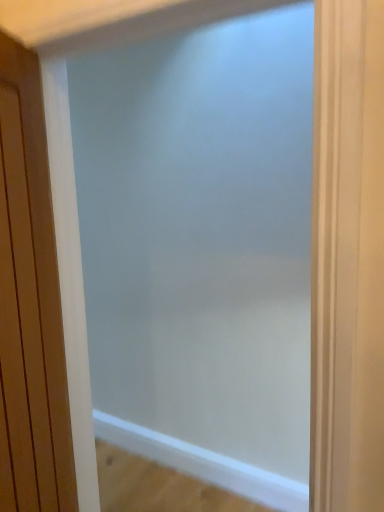
Where is `wooden door at left`? The height and width of the screenshot is (512, 384). wooden door at left is located at coordinates (30, 304).

Looking at this image, what is the approximate height of wooden door at left?

1.36 meters.

The width and height of the screenshot is (384, 512). Describe the element at coordinates (30, 304) in the screenshot. I see `wooden door at left` at that location.

In order to face wooden door at left, should I rotate leftwards or rightwards?

Answer: Turn left approximately 21.519 degrees to face it.

The width and height of the screenshot is (384, 512). What do you see at coordinates (201, 248) in the screenshot? I see `frosted glass screen door at center` at bounding box center [201, 248].

At what (x,y) coordinates should I click in order to perform the action: click on frosted glass screen door at center. Please return your answer as a coordinate pair (x, y). The height and width of the screenshot is (512, 384). Looking at the image, I should click on (201, 248).

The image size is (384, 512). Find the location of `wooden door at left`. wooden door at left is located at coordinates (30, 304).

Considering the relative positions of frosted glass screen door at center and wooden door at left in the image provided, is frosted glass screen door at center to the left of wooden door at left from the viewer's perspective?

No, frosted glass screen door at center is not to the left of wooden door at left.

Which object is further away from the camera taking this photo, frosted glass screen door at center or wooden door at left?

frosted glass screen door at center is behind.

Is point (194, 216) behind point (52, 403)?

Yes.

Based on the photo, from the image's perspective, is frosted glass screen door at center above or below wooden door at left?

Based on their image positions, frosted glass screen door at center is located beneath wooden door at left.

From a real-world perspective, who is located lower, frosted glass screen door at center or wooden door at left?

In real-world perspective, frosted glass screen door at center is lower.

Does frosted glass screen door at center have a lesser width compared to wooden door at left?

No.

Considering the relative sizes of frosted glass screen door at center and wooden door at left in the image provided, is frosted glass screen door at center taller than wooden door at left?

Correct, frosted glass screen door at center is much taller as wooden door at left.

Who is bigger, frosted glass screen door at center or wooden door at left?

frosted glass screen door at center.

Is wooden door at left inside frosted glass screen door at center?

No, wooden door at left is not a part of frosted glass screen door at center.

Is frosted glass screen door at center with wooden door at left?

frosted glass screen door at center is not next to wooden door at left, and they're not touching.

Is wooden door at left at the back of frosted glass screen door at center?

Correct, frosted glass screen door at center is looking away from wooden door at left.

What's the angular difference between frosted glass screen door at center and wooden door at left's facing directions?

They differ by 116 degrees in their facing directions.

Where is `screen door located on the right of wooden door at left`? screen door located on the right of wooden door at left is located at coordinates (201, 248).

Which is more to the left, wooden door at left or frosted glass screen door at center?

Positioned to the left is wooden door at left.

Is wooden door at left closer to camera compared to frosted glass screen door at center?

Yes.

Which is in front, point (2, 354) or point (253, 152)?

The point (2, 354) is closer.

From the image's perspective, which is above, wooden door at left or frosted glass screen door at center?

wooden door at left appears higher in the image.

From a real-world perspective, which object stands above the other?

In real-world perspective, wooden door at left is above.

Can you confirm if wooden door at left is wider than frosted glass screen door at center?

No, wooden door at left is not wider than frosted glass screen door at center.

Looking at this image, in terms of height, does wooden door at left look taller or shorter compared to frosted glass screen door at center?

Considering their sizes, wooden door at left has less height than frosted glass screen door at center.

Which of these two, wooden door at left or frosted glass screen door at center, is bigger?

With larger size is frosted glass screen door at center.

Would you say wooden door at left contains frosted glass screen door at center?

No.

Is wooden door at left next to frosted glass screen door at center and touching it?

They are not placed beside each other.

Does wooden door at left turn towards frosted glass screen door at center?

Yes, wooden door at left faces towards frosted glass screen door at center.

Locate an element on the screen. screen door on the right of wooden door at left is located at coordinates (201, 248).

Where is `door in front of the frosted glass screen door at center`? This screenshot has height=512, width=384. door in front of the frosted glass screen door at center is located at coordinates (30, 304).

Identify the location of door on the left of frosted glass screen door at center. Image resolution: width=384 pixels, height=512 pixels. (30, 304).